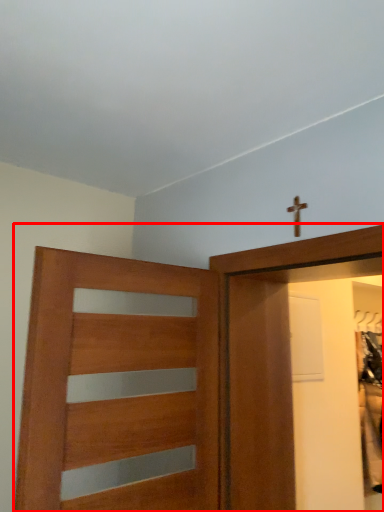
Question: From the image's perspective, what is the correct spatial positioning of door (annotated by the red box) in reference to crucifix?

Choices:
 (A) above
 (B) below

Answer: (B)